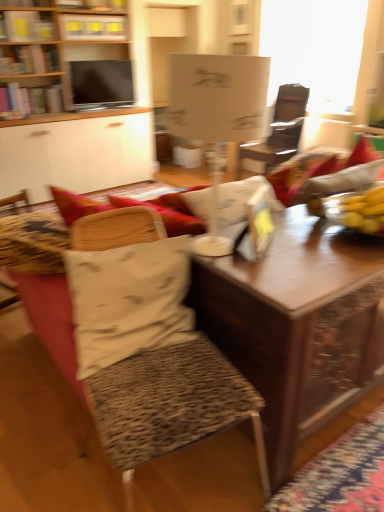
I want to click on wooden bookshelf at upper center, so click(93, 27).

The image size is (384, 512). Identify the location of white fabric pillow at center. (129, 301).

At what (x,y) coordinates should I click in order to perform the action: click on leopard print cushion at center. Please return your answer as a coordinate pair (x, y). Looking at the image, I should click on (151, 356).

Locate an element on the screen. matte black tv at upper left is located at coordinates (101, 84).

Which of these two, wooden bookshelf at upper center or white matte lampshade at center, is smaller?

Smaller between the two is wooden bookshelf at upper center.

Who is more distant, wooden bookshelf at upper center or white matte lampshade at center?

wooden bookshelf at upper center is further away from the camera.

From a real-world perspective, which is physically below, wooden bookshelf at upper center or white matte lampshade at center?

white matte lampshade at center, from a real-world perspective.

Are wooden bookshelf at upper center and white matte lampshade at center making contact?

A: No, wooden bookshelf at upper center is not next to white matte lampshade at center.

From a real-world perspective, is white matte lampshade at center positioned over wooden bookshelf at upper center based on gravity?

No, from a real-world perspective, white matte lampshade at center is not above wooden bookshelf at upper center.

Is white matte lampshade at center with wooden bookshelf at upper center?

No, white matte lampshade at center is not next to wooden bookshelf at upper center.

Between white matte lampshade at center and wooden bookshelf at upper center, which one appears on the left side from the viewer's perspective?

wooden bookshelf at upper center is more to the left.

Which of these two, white matte lampshade at center or wooden bookshelf at upper center, stands taller?

With more height is white matte lampshade at center.

Who is smaller, wooden table at center or matte black tv at upper left?

matte black tv at upper left is smaller.

Is the surface of wooden table at center in direct contact with matte black tv at upper left?

There is a gap between wooden table at center and matte black tv at upper left.

Which is in front, wooden table at center or matte black tv at upper left?

wooden table at center is more forward.

Considering the points (251, 334) and (113, 65), which point is behind, point (251, 334) or point (113, 65)?

The point (113, 65) is farther.

Measure the distance from wooden bookshelf at upper center to white paper at upper left.

wooden bookshelf at upper center and white paper at upper left are 15.06 inches apart.

From the image's perspective, would you say wooden bookshelf at upper center is shown under white paper at upper left?

Incorrect, from the image's perspective, wooden bookshelf at upper center is higher than white paper at upper left.

Is wooden bookshelf at upper center spatially inside white paper at upper left, or outside of it?

wooden bookshelf at upper center cannot be found inside white paper at upper left.

Is wooden bookshelf at upper center closer to camera compared to white paper at upper left?

No, wooden bookshelf at upper center is further to the viewer.

From the image's perspective, which one is positioned higher, wooden bookshelf at upper left or leopard print cushion at center?

wooden bookshelf at upper left.

Is wooden bookshelf at upper left positioned far away from leopard print cushion at center?

Yes, wooden bookshelf at upper left and leopard print cushion at center are quite far apart.

Is wooden bookshelf at upper left not inside leopard print cushion at center?

Yes, wooden bookshelf at upper left is not within leopard print cushion at center.

Which object is positioned more to the right, wooden bookshelf at upper left or leopard print cushion at center?

leopard print cushion at center is more to the right.

The width and height of the screenshot is (384, 512). I want to click on pillow on the right side of wooden desk at center, so click(129, 301).

Which is behind, white fabric pillow at center or wooden desk at center?

wooden desk at center is further from the camera.

Looking at this image, is white fabric pillow at center to the right of wooden desk at center from the viewer's perspective?

Yes.

Measure the distance between white fabric pillow at center and wooden desk at center.

The distance of white fabric pillow at center from wooden desk at center is 3.16 meters.

Which of these two, wooden bookshelf at upper left or white paper at upper left, is smaller?

With smaller size is white paper at upper left.

Is wooden bookshelf at upper left in front of or behind white paper at upper left in the image?

wooden bookshelf at upper left is in front of white paper at upper left.

Which is more to the left, wooden bookshelf at upper left or white paper at upper left?

white paper at upper left is more to the left.

Where is `lamp on the right of wooden bookshelf at upper center`? This screenshot has height=512, width=384. lamp on the right of wooden bookshelf at upper center is located at coordinates (217, 116).

You are a GUI agent. You are given a task and a screenshot of the screen. Output one action in this format:
    pyautogui.click(x=<x>, y=<y>)
    Task: Click on the lamp in front of the wooden bookshelf at upper center
    
    Given the screenshot: What is the action you would take?
    pyautogui.click(x=217, y=116)

Based on their spatial positions, is wooden bookshelf at upper left or white fabric pillow at center further from wooden bookshelf at upper center?

white fabric pillow at center is positioned further to the anchor wooden bookshelf at upper center.

Based on their spatial positions, is wooden bookshelf at upper center or wooden table at center closer to matte black tv at upper left?

wooden bookshelf at upper center.

Based on their spatial positions, is leopard print cushion at center or matte black tv at upper left closer to wooden desk at center?

Based on the image, matte black tv at upper left appears to be nearer to wooden desk at center.

Estimate the real-world distances between objects in this image. Which object is further from matte black tv at upper left, wooden desk at center or wooden bookshelf at upper center?

wooden desk at center.

Looking at the image, which one is located closer to white fabric pillow at center, wooden desk at center or white matte lampshade at center?

Among the two, white matte lampshade at center is located nearer to white fabric pillow at center.

Estimate the real-world distances between objects in this image. Which object is further from wooden desk at center, white matte lampshade at center or wooden table at center?

Based on the image, wooden table at center appears to be further to wooden desk at center.

Considering their positions, is transparent glass window screen at upper right positioned closer to leopard print cushion at center than matte black tv at upper left?

The object closer to leopard print cushion at center is matte black tv at upper left.

Based on their spatial positions, is matte black tv at upper left or wooden desk at center further from white paper at upper left?

wooden desk at center is further to white paper at upper left.

This screenshot has width=384, height=512. What are the coordinates of `book between wooden bookshelf at upper center and wooden desk at center from top to bottom` in the screenshot? It's located at (27, 27).

Identify the location of table between leopard print cushion at center and transparent glass window screen at upper right in the front-back direction. Image resolution: width=384 pixels, height=512 pixels. (296, 324).

The width and height of the screenshot is (384, 512). Identify the location of book between white fabric pillow at center and matte black tv at upper left in the front-back direction. (27, 27).

At what (x,y) coordinates should I click in order to perform the action: click on pillow located between leopard print cushion at center and wooden desk at center in the depth direction. Please return your answer as a coordinate pair (x, y). Looking at the image, I should click on (129, 301).